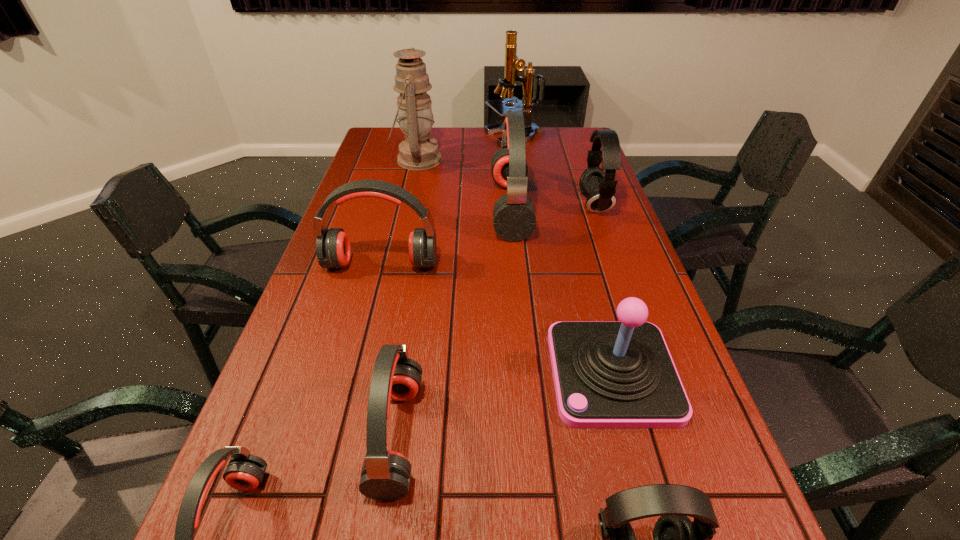
Image resolution: width=960 pixels, height=540 pixels. I want to click on blank space located at the eyepiece of the gold microscope, so click(x=435, y=137).

Find the location of a particular element. The image size is (960, 540). vacant space located 0.320m at the eyepiece of the gold microscope is located at coordinates (406, 137).

Identify the location of vacant space located 0.080m on the left of the oil lamp. This screenshot has width=960, height=540. (371, 160).

Identify the location of free spot located on the ear cups of the farthest red earphone. (407, 208).

Image resolution: width=960 pixels, height=540 pixels. What are the coordinates of `blank space located on the ear cups of the farthest red earphone` in the screenshot? It's located at (438, 208).

You are a GUI agent. You are given a task and a screenshot of the screen. Output one action in this format:
    pyautogui.click(x=<x>, y=<y>)
    Task: Click on the vacant space located on the ear cups of the farthest red earphone
    The height and width of the screenshot is (540, 960).
    Given the screenshot: What is the action you would take?
    pyautogui.click(x=391, y=208)

Identify the location of vacant area situated 0.170m on the ear cups of the second biggest red earphone. click(367, 325).

This screenshot has height=540, width=960. Identify the location of free point located 0.250m on the ear cups of the farther black earphone. (502, 205).

Identify the location of vacant area situated 0.120m on the ear cups of the farther black earphone. The width and height of the screenshot is (960, 540). (542, 205).

The image size is (960, 540). I want to click on vacant space located 0.310m on the ear cups of the farther black earphone, so click(484, 205).